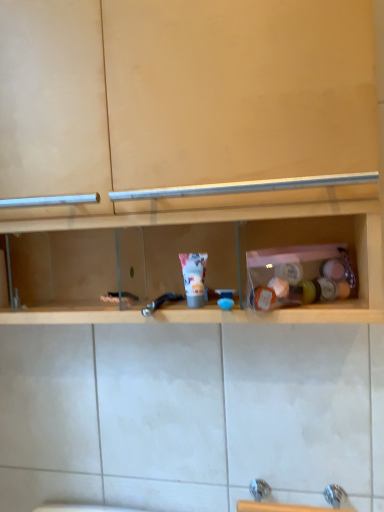
Question: Would you say metallic blue faucet at center is a long distance from white matte tube at center?

Choices:
 (A) no
 (B) yes

Answer: (A)

Question: Can white matte tube at center be found inside metallic blue faucet at center?

Choices:
 (A) no
 (B) yes

Answer: (A)

Question: Is metallic blue faucet at center wider than white matte tube at center?

Choices:
 (A) no
 (B) yes

Answer: (B)

Question: Is metallic blue faucet at center positioned with its back to white matte tube at center?

Choices:
 (A) no
 (B) yes

Answer: (A)

Question: Can you confirm if metallic blue faucet at center is positioned to the right of white matte tube at center?

Choices:
 (A) yes
 (B) no

Answer: (B)

Question: Does metallic blue faucet at center appear on the left side of white matte tube at center?

Choices:
 (A) yes
 (B) no

Answer: (A)

Question: From the image's perspective, is white matte tube at center located beneath wooden shelf at center?

Choices:
 (A) no
 (B) yes

Answer: (B)

Question: Is white matte tube at center not near wooden shelf at center?

Choices:
 (A) yes
 (B) no

Answer: (B)

Question: Considering the relative positions of white matte tube at center and wooden shelf at center in the image provided, is white matte tube at center to the right of wooden shelf at center from the viewer's perspective?

Choices:
 (A) no
 (B) yes

Answer: (B)

Question: Is white matte tube at center placed right next to wooden shelf at center?

Choices:
 (A) yes
 (B) no

Answer: (B)

Question: Is white matte tube at center surrounding wooden shelf at center?

Choices:
 (A) yes
 (B) no

Answer: (B)

Question: Is white matte tube at center positioned before wooden shelf at center?

Choices:
 (A) no
 (B) yes

Answer: (A)

Question: Is white matte tube at center behind metallic blue faucet at center?

Choices:
 (A) yes
 (B) no

Answer: (A)